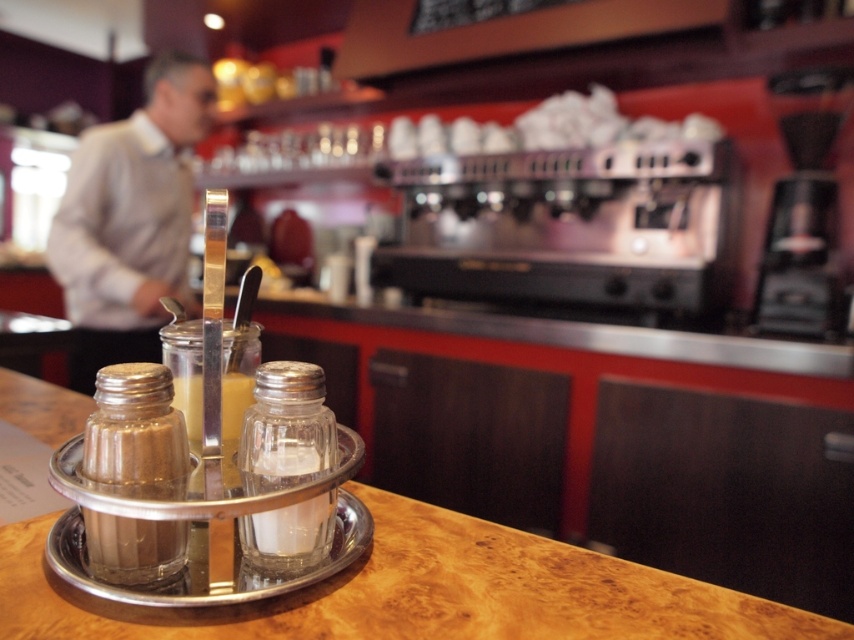
You are standing in front of the condiment holder on the wooden countertop. You notice two points marked on the counter. The first point is at coordinate point[284,474] and the second is at point[250,397]. Which point is closer to you?

Point[284,474] is closer to you than point[250,397].

You are a customer trying to reach the black plastic coffee machine at right from the wooden counter at center. Which direction should you move to get there?

The wooden counter at center is smaller than the black plastic coffee machine at right, so you should move to the right to reach the black plastic coffee machine at right from the wooden counter at center.